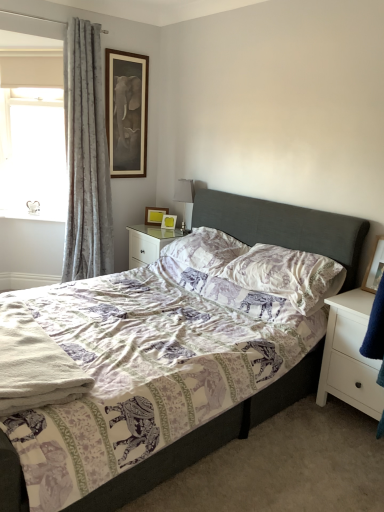
Question: Is wooden picture frame at upper center, arranged as the 2th picture frame when viewed from the back, to the right of white matte nightstand at right, the 2th nightstand from the top, from the viewer's perspective?

Choices:
 (A) no
 (B) yes

Answer: (A)

Question: Can you confirm if wooden picture frame at upper center, which is the second picture frame in bottom-to-top order, is bigger than white matte nightstand at right, the 2th nightstand from the top?

Choices:
 (A) no
 (B) yes

Answer: (A)

Question: Can you confirm if wooden picture frame at upper center, marked as the 3th picture frame in a top-to-bottom arrangement, is thinner than white matte nightstand at right, placed as the second nightstand when sorted from back to front?

Choices:
 (A) no
 (B) yes

Answer: (B)

Question: Does wooden picture frame at upper center, positioned as the 3th picture frame in front-to-back order, turn towards white matte nightstand at right, which is the first nightstand in bottom-to-top order?

Choices:
 (A) yes
 (B) no

Answer: (B)

Question: Does wooden picture frame at upper center, arranged as the 2th picture frame when viewed from the back, have a greater width compared to white matte nightstand at right, marked as the second nightstand in a left-to-right arrangement?

Choices:
 (A) no
 (B) yes

Answer: (A)

Question: From the image's perspective, relative to purple printed pillow at center, which ranks as the 1th pillow in back-to-front order, is white soft towel at lower left above or below?

Choices:
 (A) above
 (B) below

Answer: (B)

Question: Is white soft towel at lower left spatially inside purple printed pillow at center, arranged as the second pillow when viewed from the front, or outside of it?

Choices:
 (A) outside
 (B) inside

Answer: (A)

Question: Does point (44, 388) appear closer or farther from the camera than point (185, 256)?

Choices:
 (A) closer
 (B) farther

Answer: (A)

Question: From their relative heights in the image, would you say white soft towel at lower left is taller or shorter than purple printed pillow at center, arranged as the second pillow when viewed from the front?

Choices:
 (A) short
 (B) tall

Answer: (A)

Question: Is point 213,231 closer or farther from the camera than point 190,187?

Choices:
 (A) farther
 (B) closer

Answer: (B)

Question: Is purple printed pillow at center, which ranks as the 1th pillow in back-to-front order, to the left or to the right of silver metallic table lamp at upper center in the image?

Choices:
 (A) right
 (B) left

Answer: (A)

Question: From a real-world perspective, relative to silver metallic table lamp at upper center, is purple printed pillow at center, arranged as the second pillow when viewed from the front, vertically above or below?

Choices:
 (A) above
 (B) below

Answer: (B)

Question: Is purple printed pillow at center, which ranks as the 1th pillow in back-to-front order, taller or shorter than silver metallic table lamp at upper center?

Choices:
 (A) short
 (B) tall

Answer: (A)

Question: Looking at the image, does matte wooden picture frame at upper center, acting as the first picture frame starting from the top, seem bigger or smaller compared to purple printed pillow at center, arranged as the second pillow when viewed from the front?

Choices:
 (A) big
 (B) small

Answer: (B)

Question: From a real-world perspective, relative to purple printed pillow at center, which ranks as the 1th pillow in back-to-front order, is matte wooden picture frame at upper center, which is counted as the 4th picture frame, starting from the right, vertically above or below?

Choices:
 (A) above
 (B) below

Answer: (A)